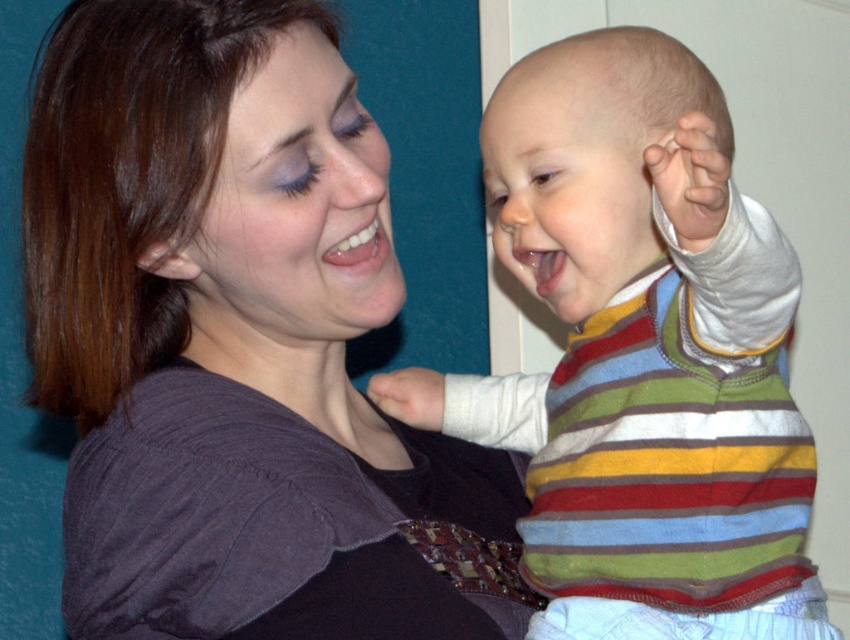
You are a photographer trying to capture the child in the striped sweater at upper right and the striped sweater at center. Which striped sweater is closer to the camera?

The striped sweater at upper right is closer to the camera than the striped sweater at center because it is in front of it.

You are observing a mother and child in an image. The scene shows a striped sweater at upper right and a striped sweater at center. Which striped sweater is located to the left of the other?

The striped sweater at upper right is positioned on the left side of striped sweater at center.